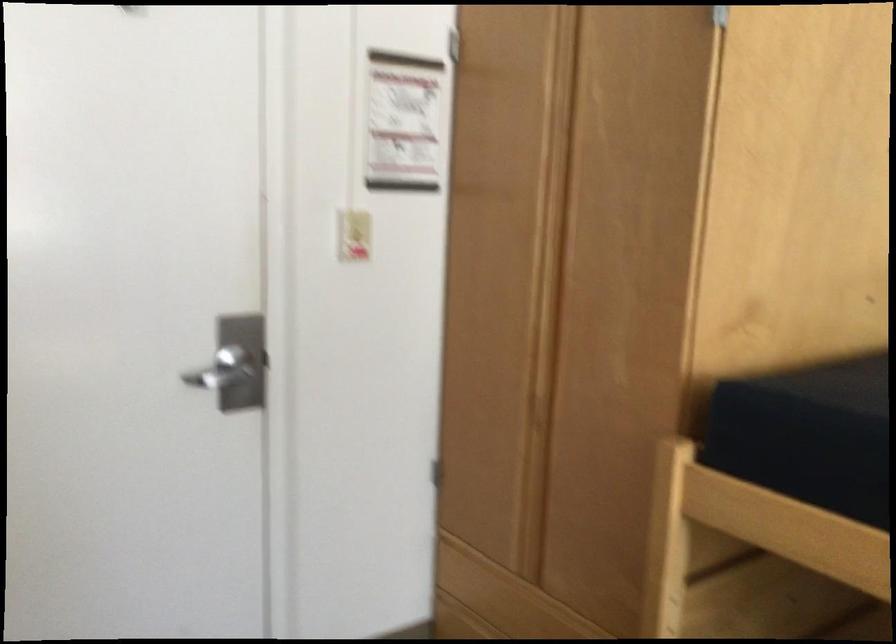
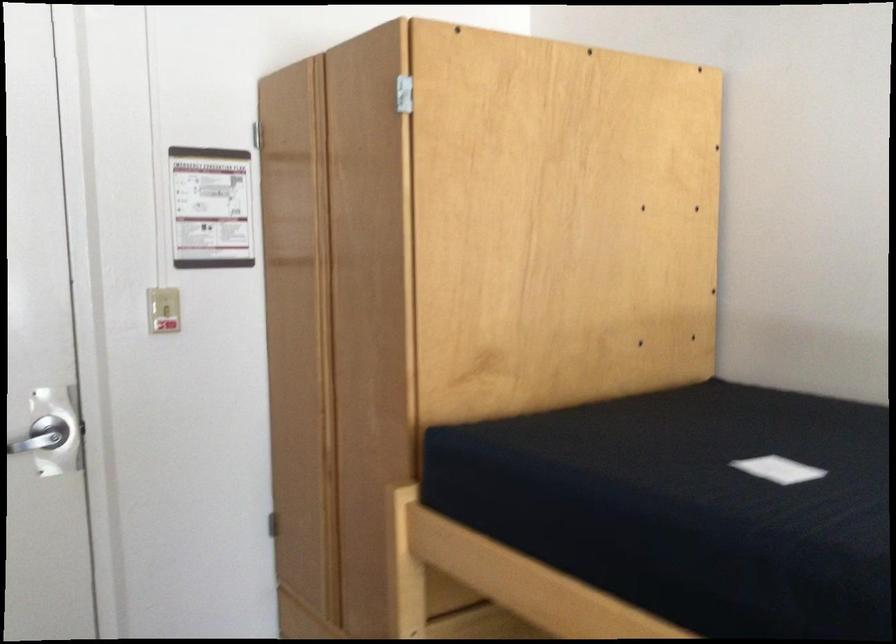
Locate, in the second image, the point that corresponds to (x=354, y=236) in the first image.

(162, 308)